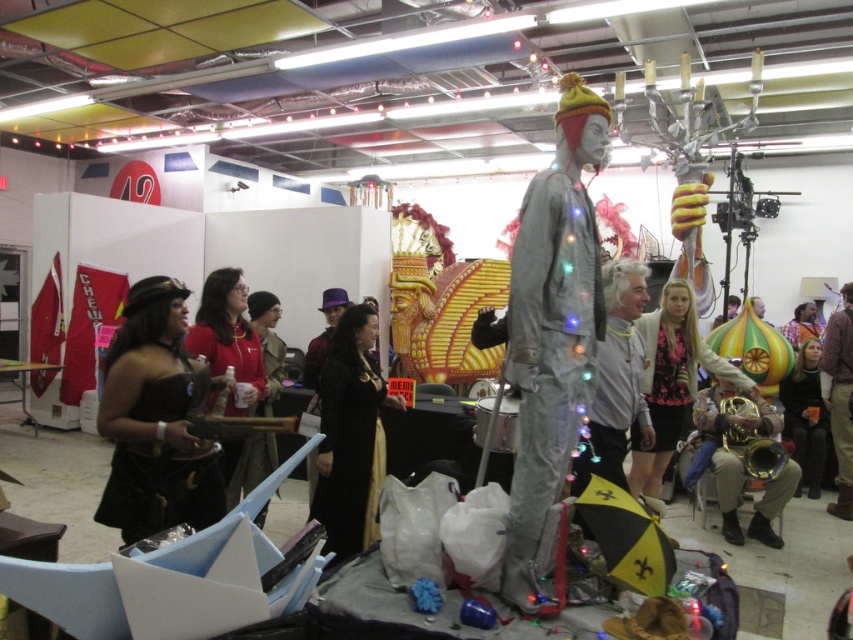
Question: Which object appears farthest from the camera in this image?

Choices:
 (A) shiny metallic mannequin at center
 (B) matte black dress at center

Answer: (B)

Question: Considering the relative positions of black leather dress at lower left and matte black dress at center in the image provided, where is black leather dress at lower left located with respect to matte black dress at center?

Choices:
 (A) right
 (B) left

Answer: (B)

Question: Is shiny metallic mannequin at center behind black leather dress at lower left?

Choices:
 (A) no
 (B) yes

Answer: (A)

Question: Is brown leather jacket at right smaller than matte black dress at center?

Choices:
 (A) yes
 (B) no

Answer: (B)

Question: Based on their relative distances, which object is nearer to the floral fabric dress at center?

Choices:
 (A) black leather dress at lower left
 (B) brown leather jacket at right
 (C) matte black dress at center

Answer: (B)

Question: Estimate the real-world distances between objects in this image. Which object is closer to the gray fabric mannequin at center?

Choices:
 (A) black velvet dress at center
 (B) matte black dress at center
 (C) shiny metallic mannequin at center

Answer: (C)